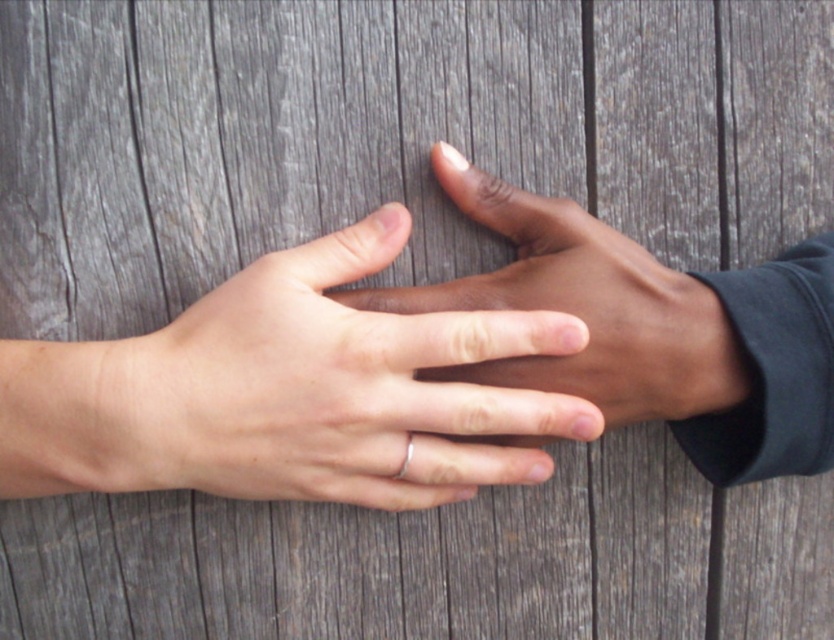
Measure the distance between point [380,490] and camera.

A distance of 22.02 inches exists between point [380,490] and camera.

Can you confirm if matte silver ring at center is taller than smooth skin hand at center?

No.

What do you see at coordinates (339, 387) in the screenshot? Image resolution: width=834 pixels, height=640 pixels. I see `matte silver ring at center` at bounding box center [339, 387].

I want to click on matte silver ring at center, so click(x=339, y=387).

Can you confirm if matte silver ring at center is thinner than silver metallic ring at center?

No.

Between matte silver ring at center and silver metallic ring at center, which one has less height?

With less height is silver metallic ring at center.

Is point (224, 490) closer to camera compared to point (404, 467)?

No.

Locate an element on the screen. This screenshot has width=834, height=640. matte silver ring at center is located at coordinates (339, 387).

Based on the photo, who is taller, smooth skin hand at center or silver metallic ring at center?

With more height is smooth skin hand at center.

Is smooth skin hand at center to the left of silver metallic ring at center from the viewer's perspective?

In fact, smooth skin hand at center is to the right of silver metallic ring at center.

Is point (627, 272) in front of point (408, 442)?

That is False.

Where is `smooth skin hand at center`? smooth skin hand at center is located at coordinates (581, 307).